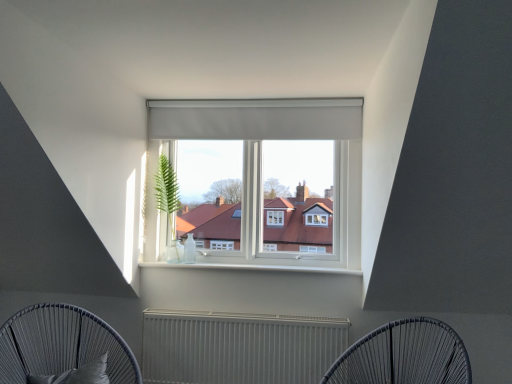
This screenshot has width=512, height=384. Identify the location of free space above green leafy plant at center (from a real-world perspective). (170, 142).